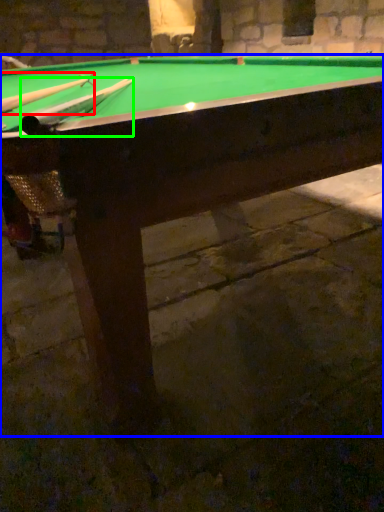
Question: Based on their relative distances, which object is farther from cue (highlighted by a red box)? Choose from billiard table (highlighted by a blue box) and cue (highlighted by a green box).

Choices:
 (A) billiard table
 (B) cue

Answer: (A)